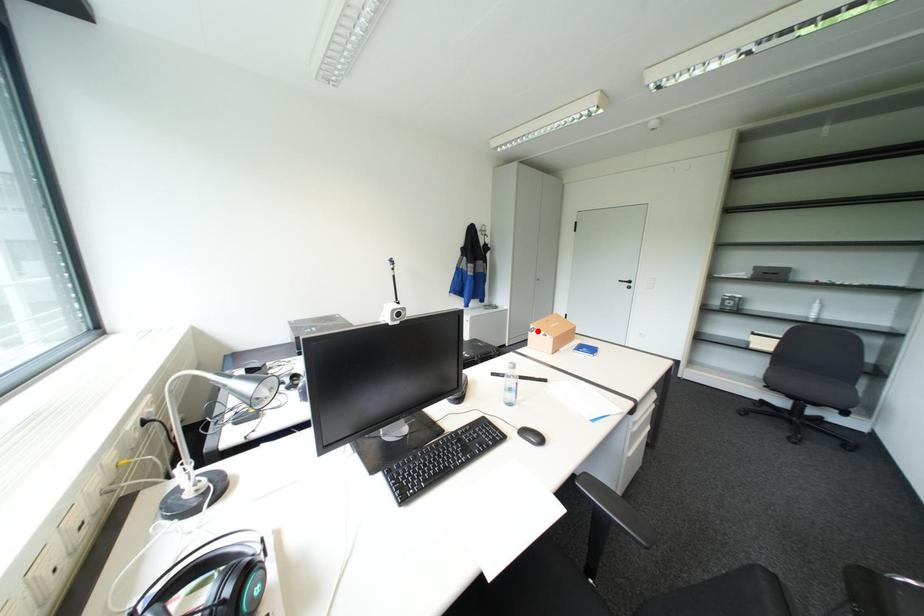
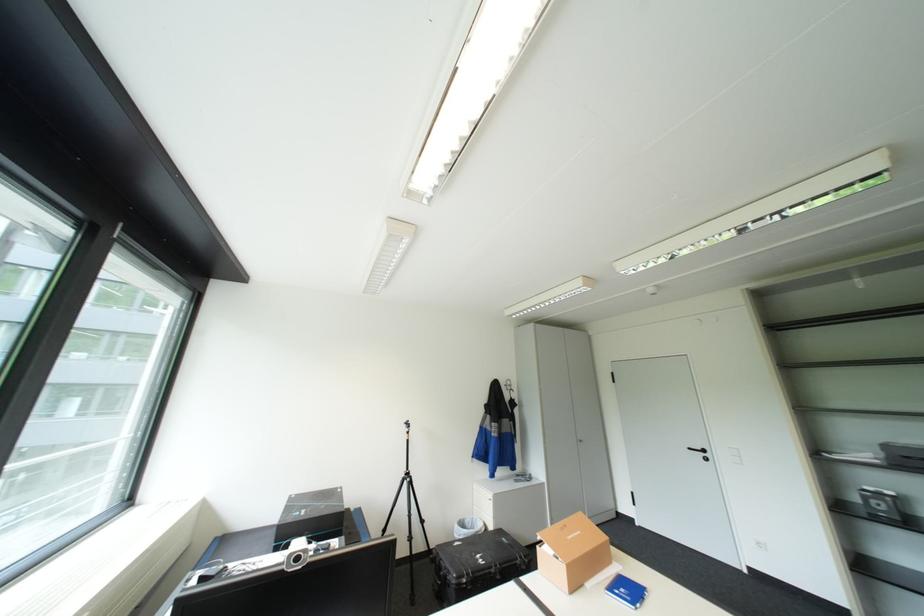
In the second image, find the point that corresponds to the highlighted location in the first image.

(545, 545)